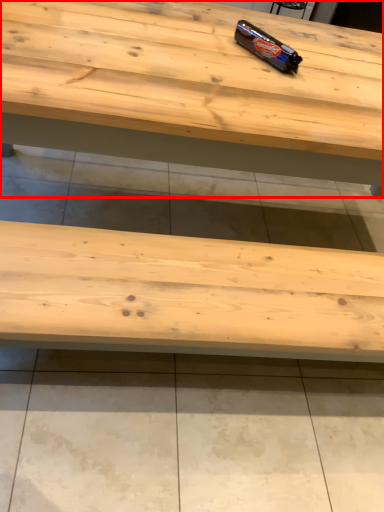
Question: In this image, where is table (annotated by the red box) located relative to chocolate bar?

Choices:
 (A) left
 (B) right

Answer: (A)